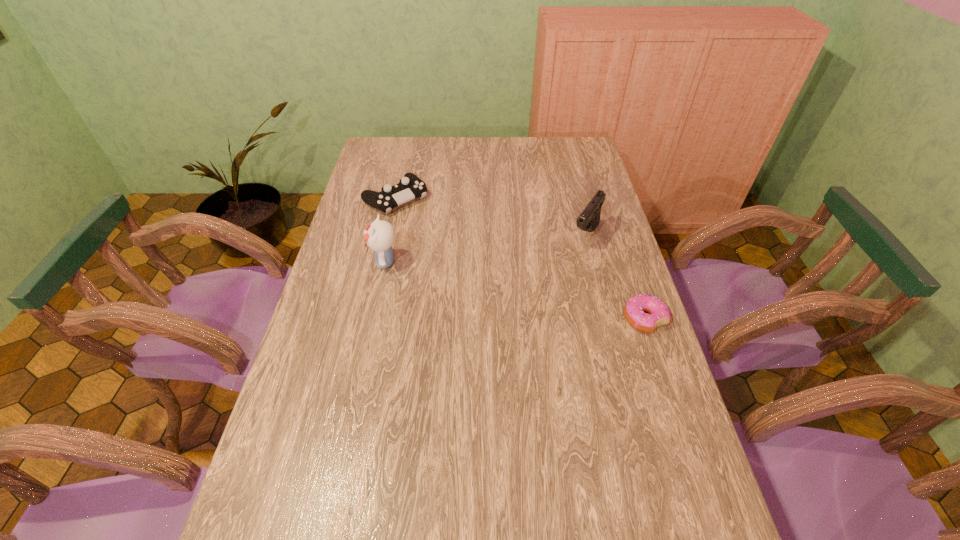
Locate an element on the screen. The height and width of the screenshot is (540, 960). vacant space on the desktop that is between the kitten and the nearest object and is positioned at the barrel of the second tallest object is located at coordinates (543, 297).

You are a GUI agent. You are given a task and a screenshot of the screen. Output one action in this format:
    pyautogui.click(x=<x>, y=<y>)
    Task: Click on the free space on the desktop that is between the kitten and the shortest object and is positioned on the surface of the control
    The image size is (960, 540).
    Given the screenshot: What is the action you would take?
    pyautogui.click(x=494, y=286)